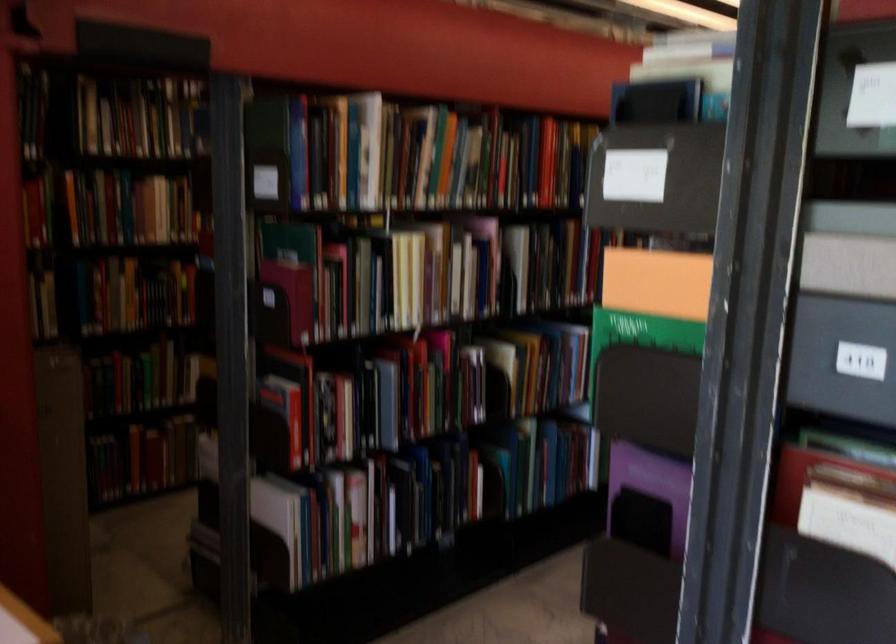
In order to click on library book in this screenshot , I will do `click(864, 611)`.